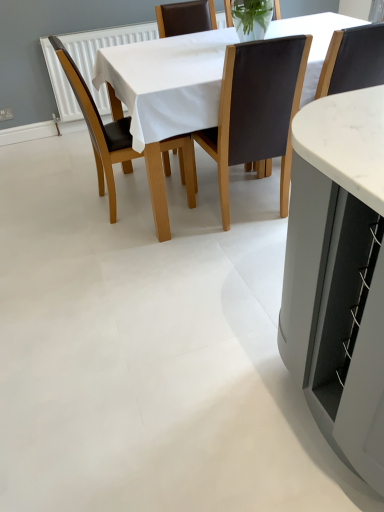
I want to click on vacant space behind brown leather chair at center, positioned as the second chair in left-to-right order, so click(243, 191).